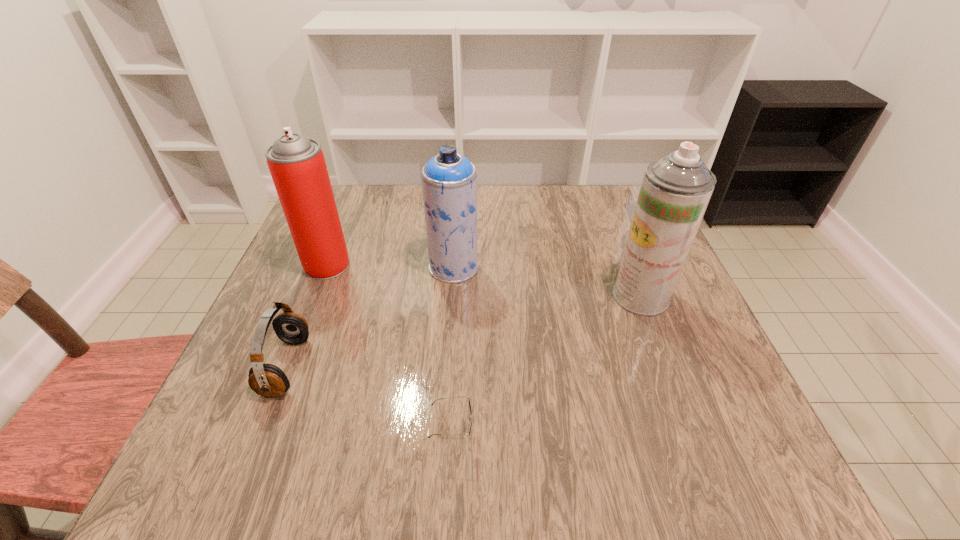
At what (x,y) coordinates should I click in order to perform the action: click on object at the near edge. Please return your answer as a coordinate pair (x, y). Image resolution: width=960 pixels, height=540 pixels. Looking at the image, I should click on (470, 404).

This screenshot has width=960, height=540. Identify the location of aerosol can located at the left edge. (296, 163).

At what (x,y) coordinates should I click in order to perform the action: click on headset that is at the left edge. Please return your answer as a coordinate pair (x, y). Image resolution: width=960 pixels, height=540 pixels. Looking at the image, I should click on (267, 380).

In order to click on object that is at the right edge in this screenshot , I will do `click(675, 191)`.

Where is `vacant space at the far edge of the desktop`? The image size is (960, 540). vacant space at the far edge of the desktop is located at coordinates (389, 210).

The height and width of the screenshot is (540, 960). Find the location of `free region at the near edge of the desktop`. free region at the near edge of the desktop is located at coordinates (324, 476).

Find the location of a particular element. free space at the left edge is located at coordinates (283, 291).

Identify the location of vacant region at the right edge of the desktop. (681, 354).

The image size is (960, 540). Identify the location of vacant space at the far right corner of the desktop. (612, 210).

Locate an element on the screen. Image resolution: width=960 pixels, height=540 pixels. blank space at the near right corner of the desktop is located at coordinates (782, 487).